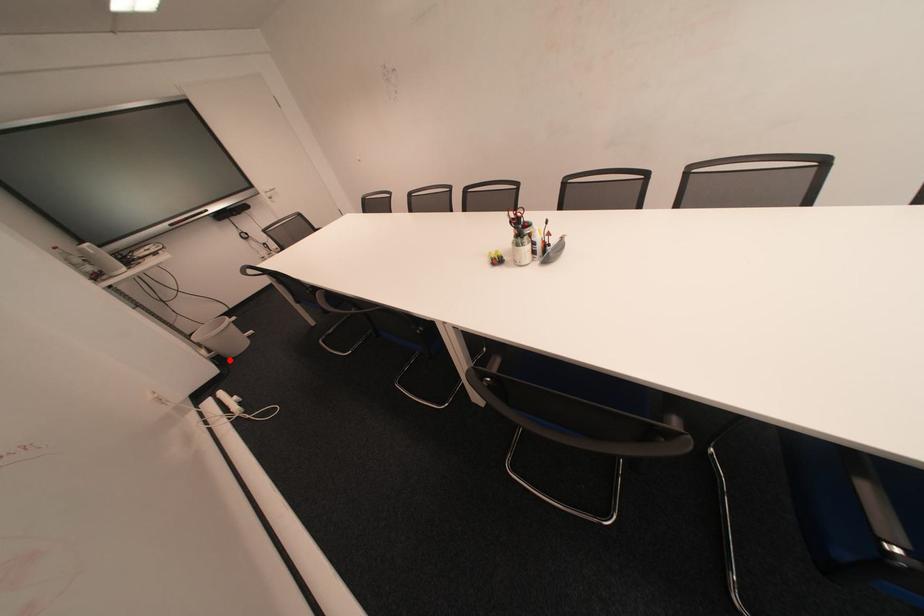
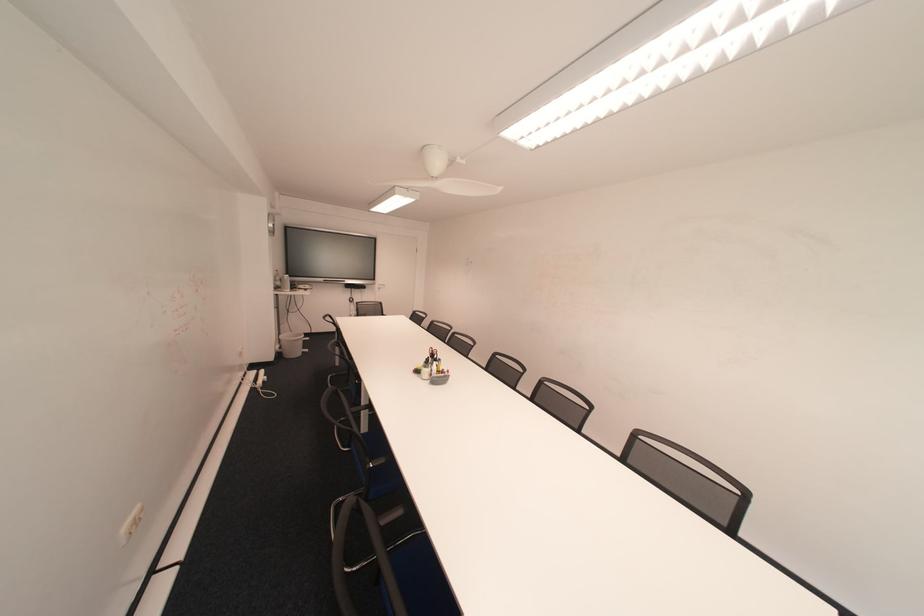
Question: I am providing you with two images of the same scene from different viewpoints. In image1, a red point is highlighted. Considering the same 3D point in image2, which of the following is correct?

Choices:
 (A) It is closer
 (B) It is farther

Answer: (B)